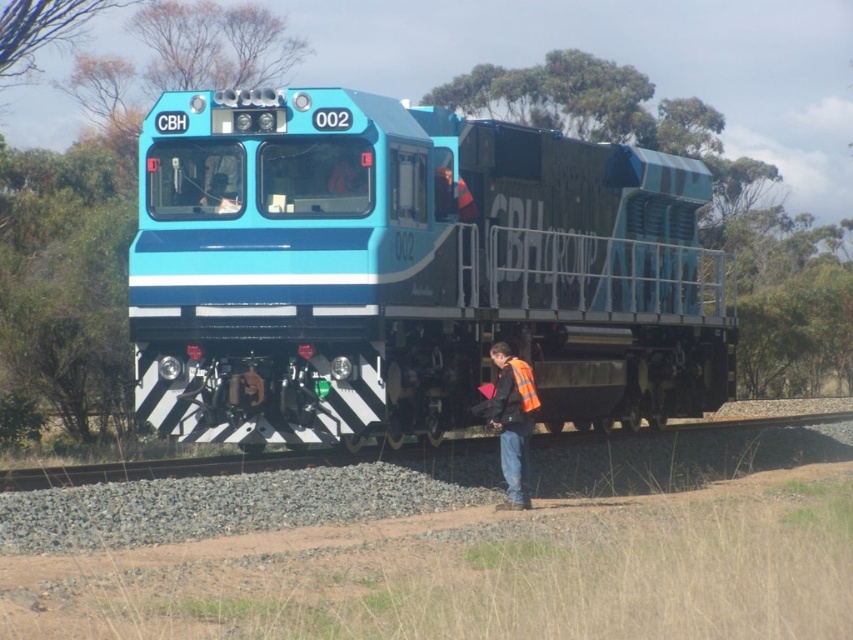
You are a passenger on the blue glossy locomotive at center and want to see the orange reflective vest at lower center. Can you see it from your current position?

The blue glossy locomotive at center is located above orange reflective vest at lower center, so yes, you can see the orange reflective vest at lower center from your current position.

You are a passenger on the CBH 002 locomotive and notice two objects at the lower center of your view. Which object is taller between the black asphalt train track at lower center and the orange reflective vest at lower center?

The orange reflective vest at lower center is taller than the black asphalt train track at lower center according to the description.